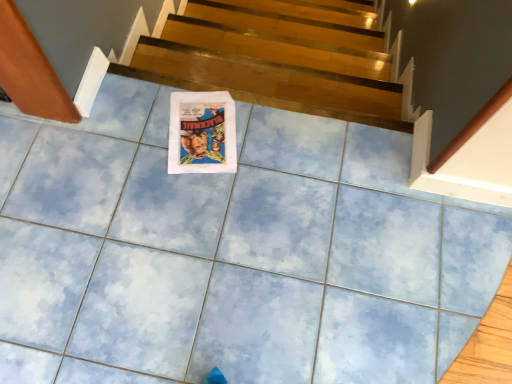
The width and height of the screenshot is (512, 384). I want to click on vacant space to the left of matte paper poster at center, so click(x=133, y=130).